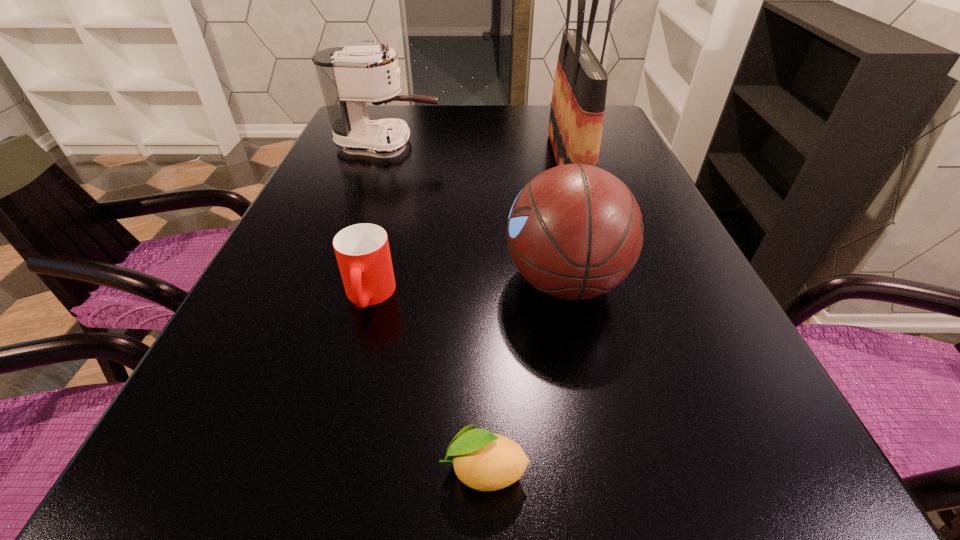
This screenshot has width=960, height=540. In order to click on the tallest object in this screenshot , I will do [x=577, y=110].

Find the location of a particular element. coffee maker is located at coordinates (349, 77).

You are a GUI agent. You are given a task and a screenshot of the screen. Output one action in this format:
    pyautogui.click(x=<x>, y=<y>)
    Task: Click on the third tallest object
    The image size is (960, 540).
    Given the screenshot: What is the action you would take?
    pyautogui.click(x=575, y=231)

I want to click on the second shortest object, so click(x=362, y=250).

The width and height of the screenshot is (960, 540). I want to click on the nearest object, so click(484, 461).

This screenshot has height=540, width=960. What are the coordinates of `the shortest object` in the screenshot? It's located at tap(484, 461).

Locate an element on the screen. This screenshot has width=960, height=540. free space located on the front-facing side of the shopping bag is located at coordinates (394, 162).

The height and width of the screenshot is (540, 960). Find the location of `vacant space located 0.120m on the front-facing side of the shopping bag`. vacant space located 0.120m on the front-facing side of the shopping bag is located at coordinates (501, 162).

You are a GUI agent. You are given a task and a screenshot of the screen. Output one action in this format:
    pyautogui.click(x=<x>, y=<y>)
    Task: Click on the vacant space located on the front-facing side of the shopping bag
    The width and height of the screenshot is (960, 540).
    Given the screenshot: What is the action you would take?
    pyautogui.click(x=405, y=162)

Where is `vacant space located 0.300m on the front-facing side of the coffee maker`? This screenshot has height=540, width=960. vacant space located 0.300m on the front-facing side of the coffee maker is located at coordinates (549, 145).